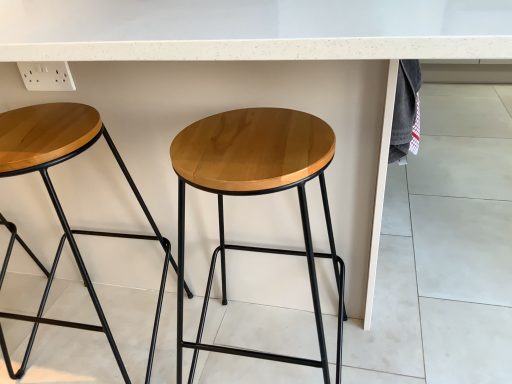
At what (x,y) coordinates should I click in order to perform the action: click on free space above wooden seat stool at center, the first stool from the left (from a real-world perspective). Please return your answer as a coordinate pair (x, y). Image resolution: width=512 pixels, height=384 pixels. Looking at the image, I should click on (x=44, y=125).